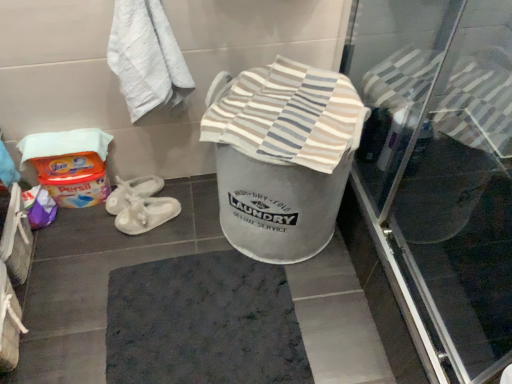
Image resolution: width=512 pixels, height=384 pixels. I want to click on empty space that is ontop of dark gray textured bath mat at center (from a real-world perspective), so (202, 318).